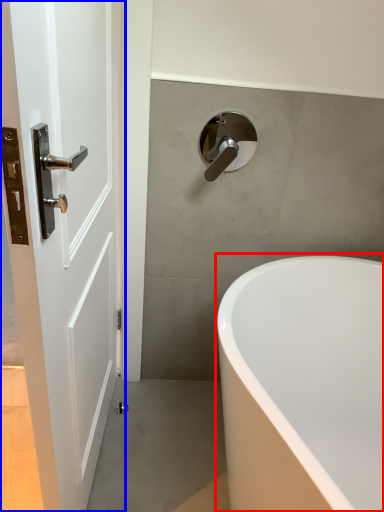
Question: Which object is closer to the camera taking this photo, bathtub (highlighted by a red box) or door (highlighted by a blue box)?

Choices:
 (A) bathtub
 (B) door

Answer: (B)